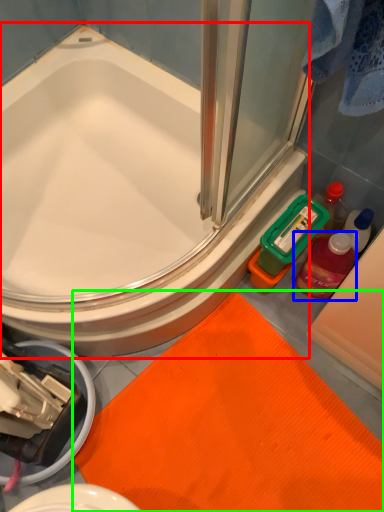
Question: Which is nearer to the bathtub (highlighted by a red box)? mouthwash (highlighted by a blue box) or bath mat (highlighted by a green box).

Choices:
 (A) mouthwash
 (B) bath mat

Answer: (B)